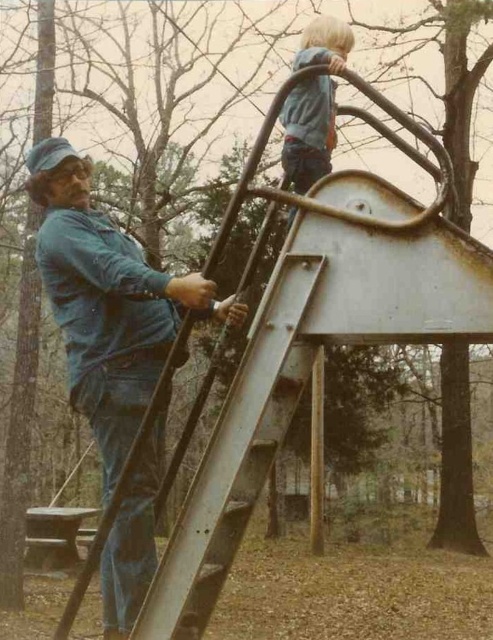
The height and width of the screenshot is (640, 493). What do you see at coordinates (106, 301) in the screenshot? I see `blue denim jeans at left` at bounding box center [106, 301].

Locate an element on the screen. The image size is (493, 640). blue denim jeans at left is located at coordinates (106, 301).